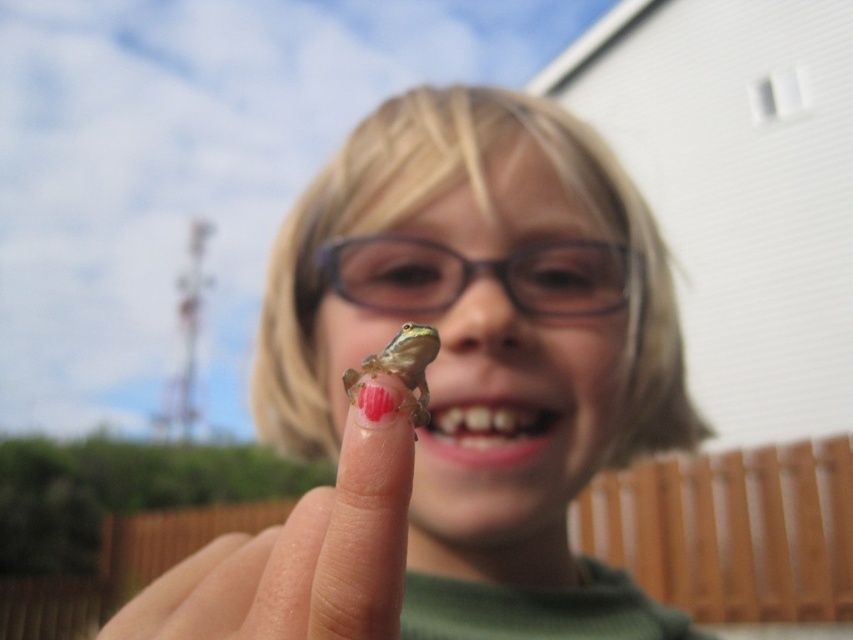
Looking at the child in the image, which object is positioned to the right of the other between the smooth green frog at center and the transparent plastic glasses at center?

The transparent plastic glasses at center are to the right of the smooth green frog at center.